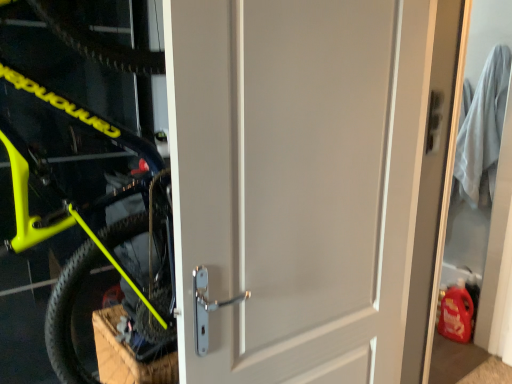
Question: Is white matte door at right bigger than neon yellow matte bicycle at left?

Choices:
 (A) no
 (B) yes

Answer: (A)

Question: Is white matte door at right at the left side of neon yellow matte bicycle at left?

Choices:
 (A) yes
 (B) no

Answer: (B)

Question: From a real-world perspective, is white matte door at right on neon yellow matte bicycle at left?

Choices:
 (A) no
 (B) yes

Answer: (A)

Question: Is white matte door at right further to the viewer compared to neon yellow matte bicycle at left?

Choices:
 (A) no
 (B) yes

Answer: (B)

Question: Considering the relative sizes of white matte door at right and neon yellow matte bicycle at left in the image provided, is white matte door at right wider than neon yellow matte bicycle at left?

Choices:
 (A) yes
 (B) no

Answer: (B)

Question: Is white matte door at right to the right of neon yellow matte bicycle at left from the viewer's perspective?

Choices:
 (A) yes
 (B) no

Answer: (A)

Question: Is white matte door at right not close to white matte door at center?

Choices:
 (A) yes
 (B) no

Answer: (A)

Question: Is white matte door at right at the left side of white matte door at center?

Choices:
 (A) yes
 (B) no

Answer: (B)

Question: Can white matte door at center be found inside white matte door at right?

Choices:
 (A) yes
 (B) no

Answer: (B)

Question: Does white matte door at right have a larger size compared to white matte door at center?

Choices:
 (A) yes
 (B) no

Answer: (A)

Question: Does white matte door at right come behind white matte door at center?

Choices:
 (A) no
 (B) yes

Answer: (B)

Question: Can you confirm if white matte door at right is wider than white matte door at center?

Choices:
 (A) no
 (B) yes

Answer: (A)

Question: From a real-world perspective, is neon yellow matte bicycle at left positioned over white matte door at right based on gravity?

Choices:
 (A) no
 (B) yes

Answer: (B)